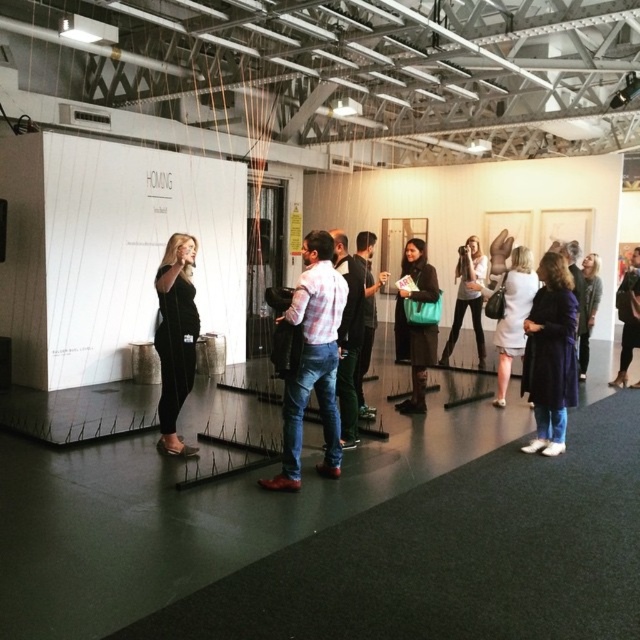
You are an event organizer who needs to place a name tag on the plaid shirt at center and the black leather jacket at center. Which one should you place the name tag on the left side of?

The plaid shirt at center is to the left of the black leather jacket at center, so you should place the name tag on the left side of the plaid shirt at center.